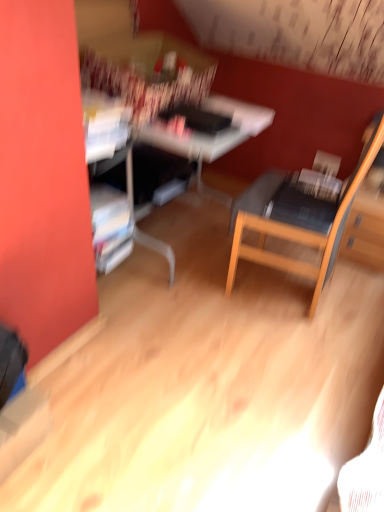
I want to click on vacant space in front of wooden chair at center-right, so click(x=276, y=367).